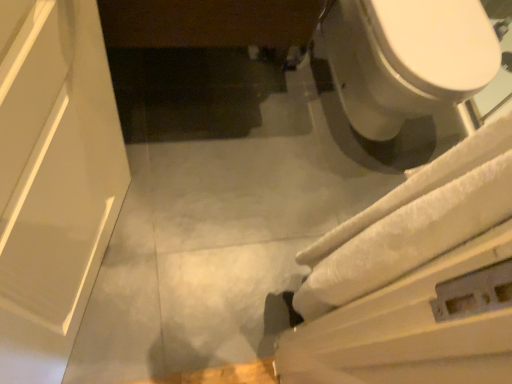
Where is `free region on the left part of white glossy toilet at upper right`? The width and height of the screenshot is (512, 384). free region on the left part of white glossy toilet at upper right is located at coordinates (x=242, y=81).